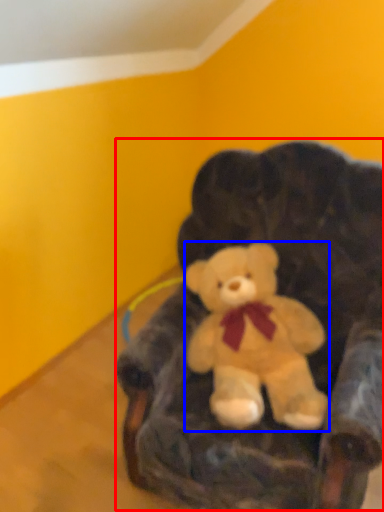
Question: Which of the following is the farthest to the observer, bean bag chair (highlighted by a red box) or teddy bear (highlighted by a blue box)?

Choices:
 (A) bean bag chair
 (B) teddy bear

Answer: (B)